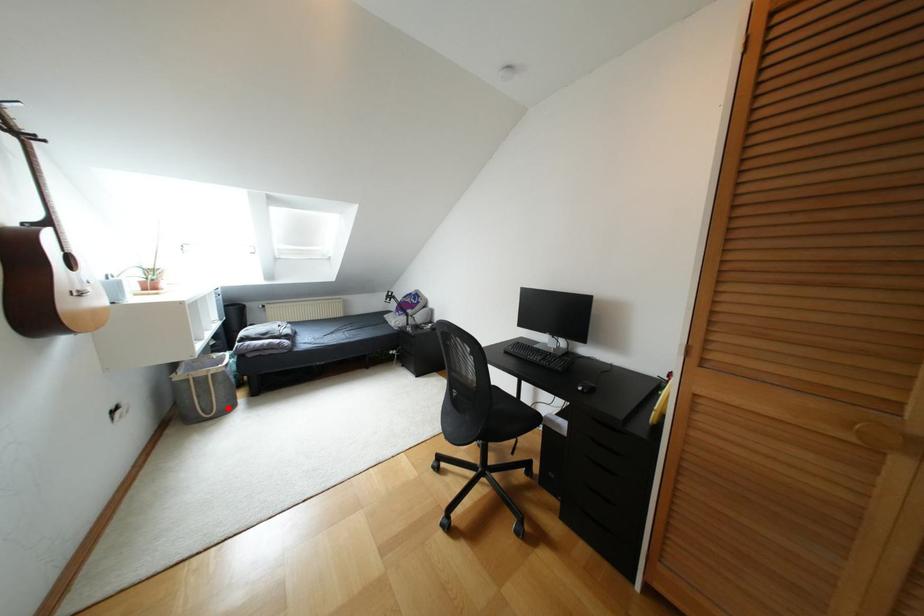
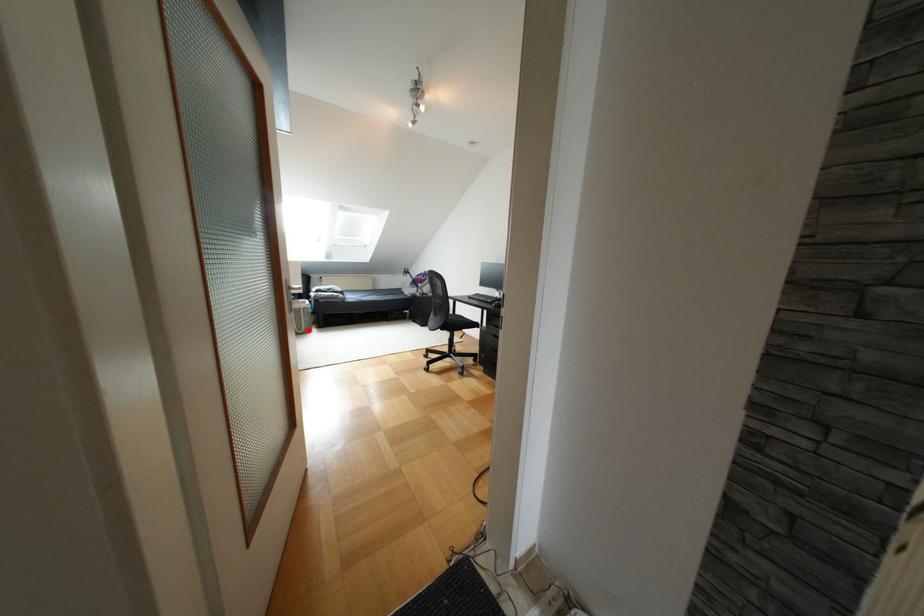
I am providing you with two images of the same scene from different viewpoints. A red point is marked on the first image and another point is marked on the second image. Are the points marked in image1 and image2 representing the same 3D position?

Yes